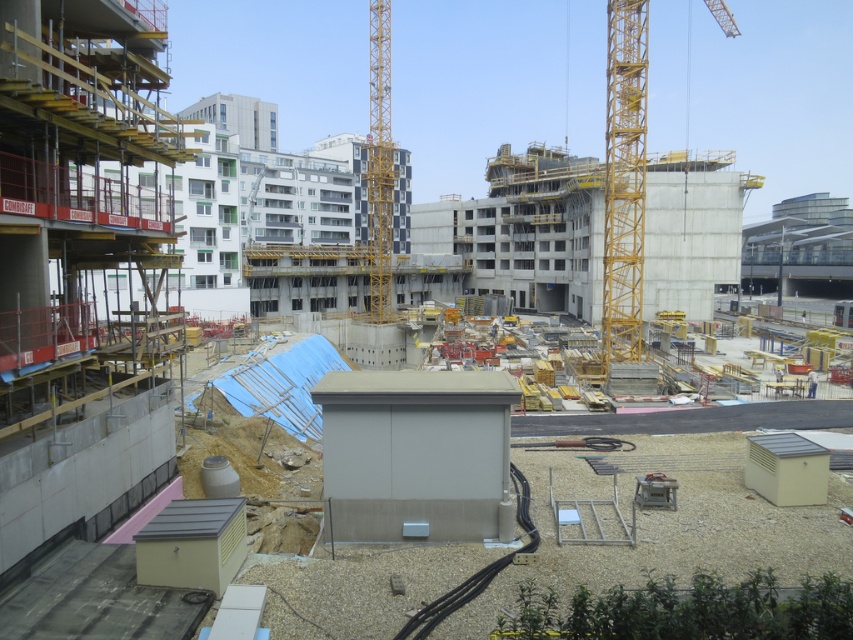
Question: Estimate the real-world distances between objects in this image. Which object is farther from the concrete wall at left?

Choices:
 (A) metallic gray generator at lower right
 (B) yellow metallic crane at upper right

Answer: (B)

Question: Among these points, which one is farthest from the camera?

Choices:
 (A) (32, 580)
 (B) (660, 476)

Answer: (B)

Question: Is concrete wall at left bigger than metallic gray generator at lower right?

Choices:
 (A) yes
 (B) no

Answer: (A)

Question: Among these objects, which one is nearest to the camera?

Choices:
 (A) metallic gray generator at lower right
 (B) concrete wall at left
 (C) yellow metallic crane at upper right

Answer: (B)

Question: Can you confirm if concrete wall at left is smaller than yellow metallic crane at upper right?

Choices:
 (A) no
 (B) yes

Answer: (B)

Question: Is yellow metallic crane at upper right below metallic gray generator at lower right?

Choices:
 (A) yes
 (B) no

Answer: (B)